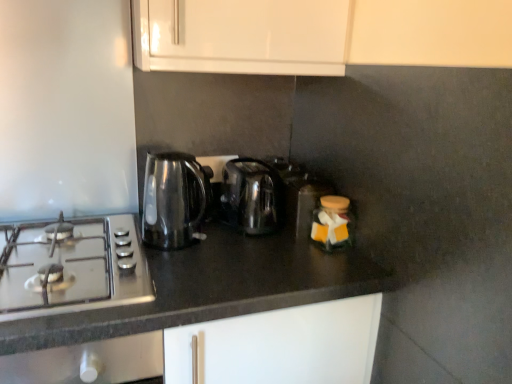
I want to click on free space to the left of matte glass jar at center right, marked as the 1th appliance in a front-to-back arrangement, so click(x=267, y=246).